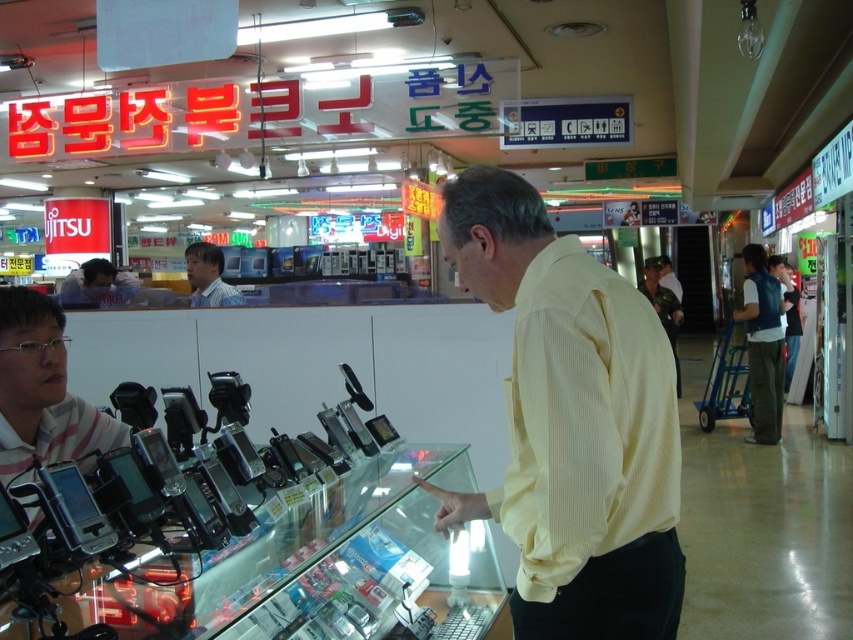
Between yellow striped shirt at center and striped cotton shirt at left, which one has less height?

striped cotton shirt at left is shorter.

Which is in front, point (525, 442) or point (48, 451)?

Point (525, 442)

The image size is (853, 640). What do you see at coordinates (572, 422) in the screenshot? I see `yellow striped shirt at center` at bounding box center [572, 422].

Locate an element on the screen. yellow striped shirt at center is located at coordinates (572, 422).

Does yellow striped shirt at center have a greater width compared to blue denim vest at right?

No.

Who is taller, yellow striped shirt at center or blue denim vest at right?

blue denim vest at right is taller.

Describe the element at coordinates (572, 422) in the screenshot. I see `yellow striped shirt at center` at that location.

You are a GUI agent. You are given a task and a screenshot of the screen. Output one action in this format:
    pyautogui.click(x=<x>, y=<y>)
    Task: Click on the yellow striped shirt at center
    
    Given the screenshot: What is the action you would take?
    pyautogui.click(x=572, y=422)

Is point (199, 243) positioned in front of point (650, 273)?

Yes, point (199, 243) is closer to viewer.

Measure the distance between point (234, 291) and camera.

A distance of 4.81 meters exists between point (234, 291) and camera.

This screenshot has height=640, width=853. Find the location of `light blue shirt at left`. light blue shirt at left is located at coordinates (207, 276).